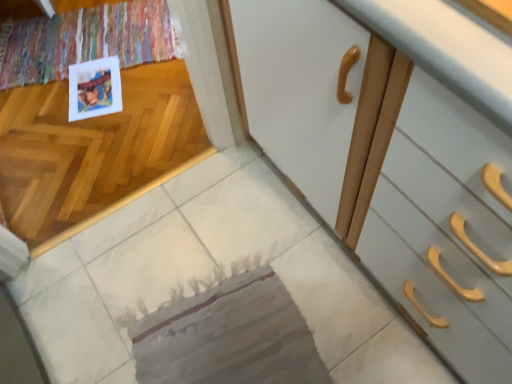
Identify the location of free space that is to the left of textured gray mat at center. This screenshot has width=512, height=384. (83, 310).